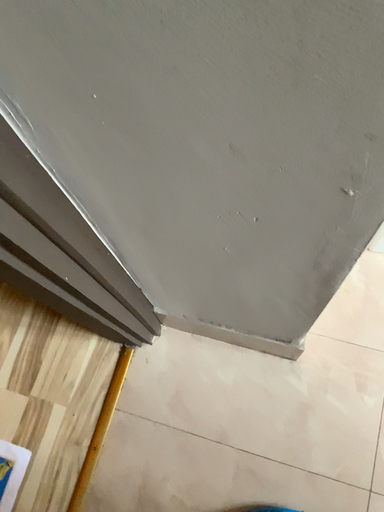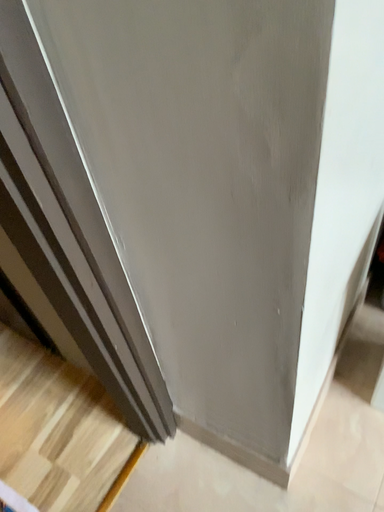
Question: Which way did the camera rotate in the video?

Choices:
 (A) rotated upward
 (B) rotated downward

Answer: (A)